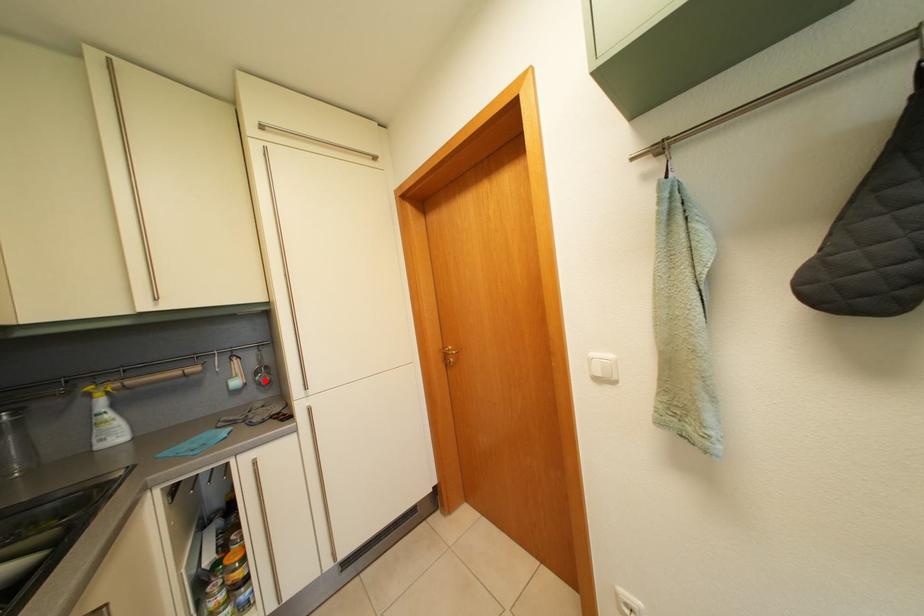
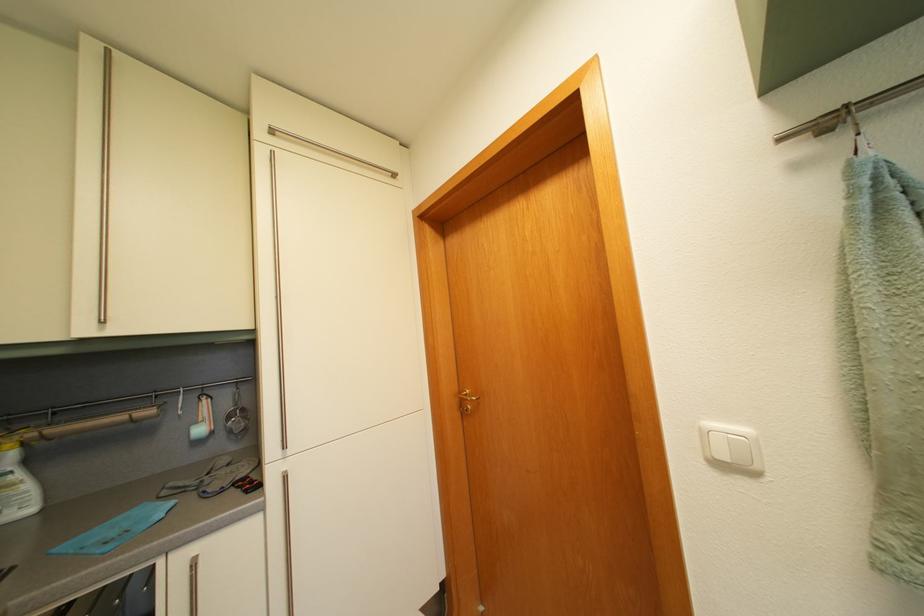
Question: I am providing you with two images of the same scene from different viewpoints. A red point is marked on the first image. Is the red point's position out of view in image 2?

Choices:
 (A) Yes
 (B) No

Answer: (B)